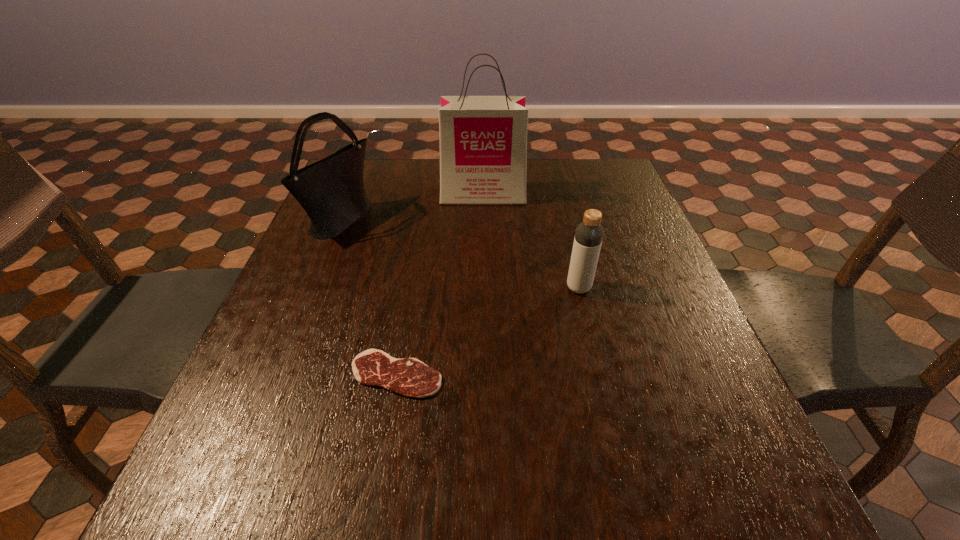
Locate an element on the screen. This screenshot has width=960, height=540. free space at the far right corner of the desktop is located at coordinates (620, 172).

At what (x,y) coordinates should I click in order to perform the action: click on free space between the rightmost object and the shopping bag. Please return your answer as a coordinate pair (x, y). This screenshot has height=540, width=960. Looking at the image, I should click on (531, 241).

Identify the location of vacant region between the rightmost object and the nearest object. The height and width of the screenshot is (540, 960). (488, 331).

Find the location of a particular element. The image size is (960, 540). empty space that is in between the second tallest object and the third tallest object is located at coordinates (460, 254).

At what (x,y) coordinates should I click in order to perform the action: click on free space between the leftmost object and the steak. Please return your answer as a coordinate pair (x, y). Looking at the image, I should click on click(x=369, y=298).

Find the location of `free space between the leftmost object and the nearest object`. free space between the leftmost object and the nearest object is located at coordinates (369, 298).

Where is `empty space between the leftmost object and the shopping bag`? empty space between the leftmost object and the shopping bag is located at coordinates (412, 208).

This screenshot has width=960, height=540. I want to click on vacant region between the second shortest object and the leftmost object, so click(x=460, y=254).

This screenshot has height=540, width=960. I want to click on vacant area that lies between the third farthest object and the shortest object, so click(x=488, y=331).

Find the location of `free space between the steak and the shopping bag`. free space between the steak and the shopping bag is located at coordinates (440, 285).